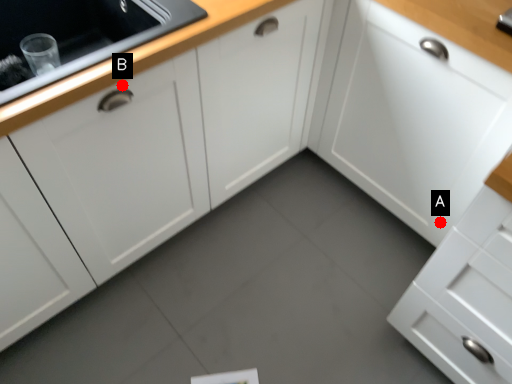
Question: Two points are circled on the image, labeled by A and B beside each circle. Among these points, which one is nearest to the camera?

Choices:
 (A) A is closer
 (B) B is closer

Answer: (B)